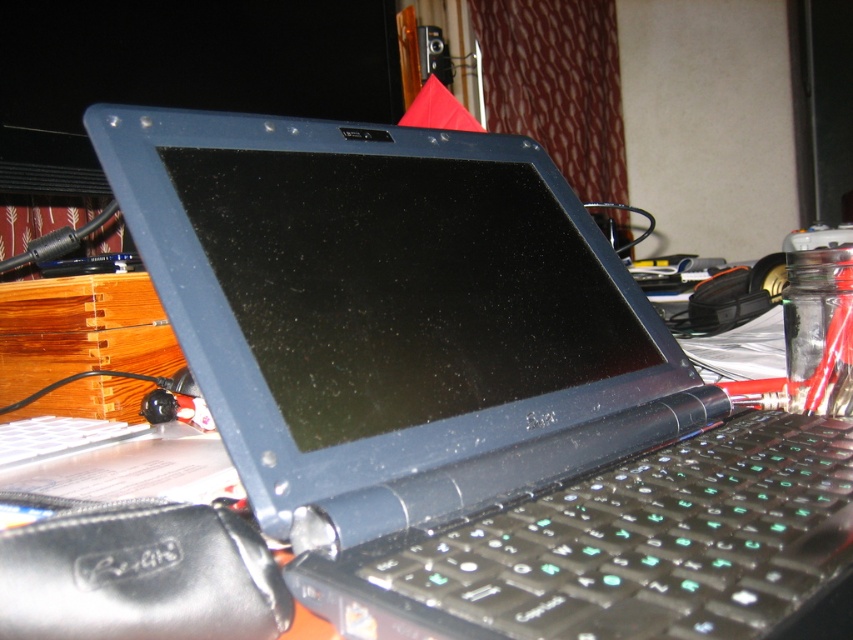
Question: Is black plastic keyboard at center to the left of white plastic keyboard at lower left from the viewer's perspective?

Choices:
 (A) yes
 (B) no

Answer: (B)

Question: Which point is closer to the camera?

Choices:
 (A) black leather pouch at lower left
 (B) white plastic keyboard at lower left

Answer: (A)

Question: Which point is farther to the camera?

Choices:
 (A) black plastic keyboard at center
 (B) black leather pouch at lower left
 (C) white plastic keyboard at lower left

Answer: (C)

Question: Where is black plastic keyboard at center located in relation to black leather pouch at lower left in the image?

Choices:
 (A) left
 (B) right

Answer: (B)

Question: In this image, where is black plastic keyboard at center located relative to black leather pouch at lower left?

Choices:
 (A) right
 (B) left

Answer: (A)

Question: Which point is farther to the camera?

Choices:
 (A) white plastic keyboard at lower left
 (B) black plastic keyboard at center
 (C) black leather pouch at lower left

Answer: (A)